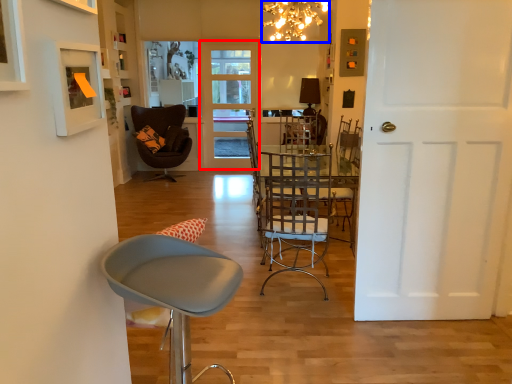
Question: Which object appears closest to the camera in this image, door (highlighted by a red box) or lamp (highlighted by a blue box)?

Choices:
 (A) door
 (B) lamp

Answer: (B)